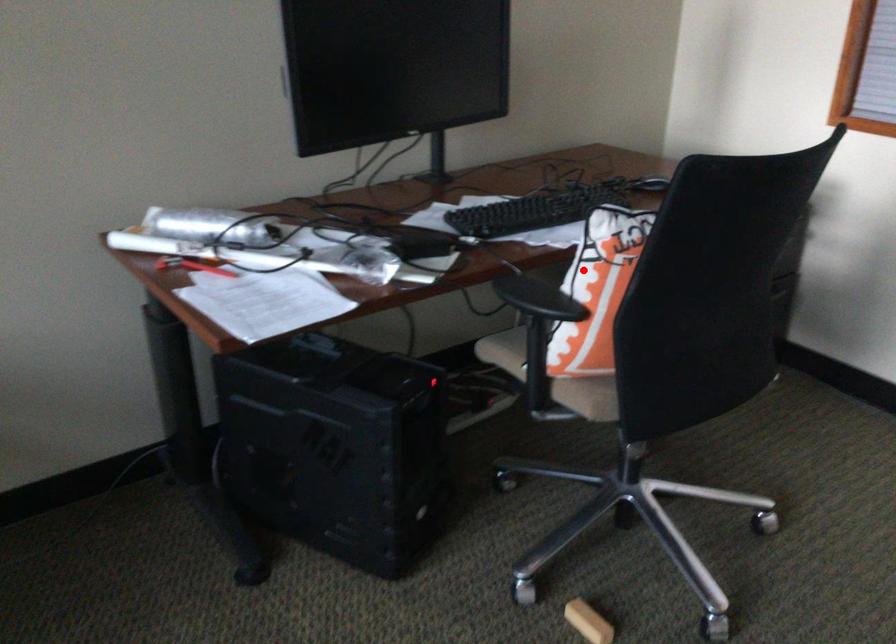
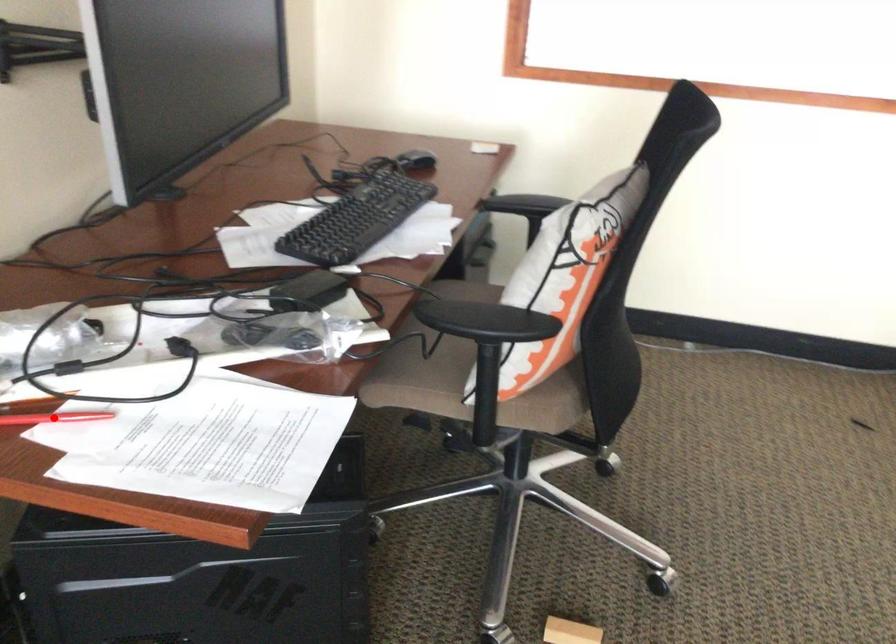
I am providing you with two images of the same scene from different viewpoints. A red point is marked on the first image and another point is marked on the second image. Is the red point in image1 aligned with the point shown in image2?

No